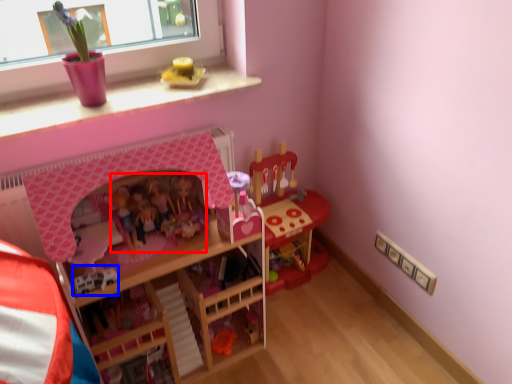
Question: Which object is further to the camera taking this photo, toy (highlighted by a red box) or toy (highlighted by a blue box)?

Choices:
 (A) toy
 (B) toy

Answer: (A)